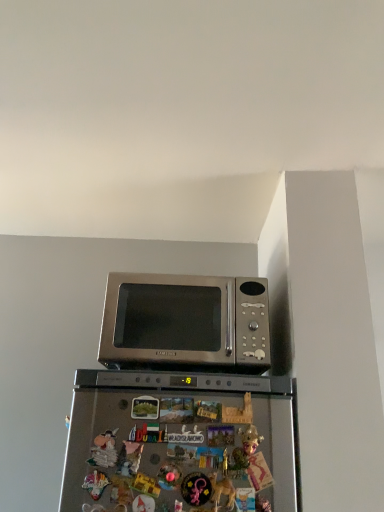
In the scene shown: What is the approximate width of stainless steel microwave at upper center?

It is 17.97 inches.

This screenshot has width=384, height=512. What do you see at coordinates (185, 323) in the screenshot?
I see `stainless steel microwave at upper center` at bounding box center [185, 323].

This screenshot has width=384, height=512. What are the coordinates of `stainless steel microwave at upper center` in the screenshot? It's located at (185, 323).

Measure the distance between point (185, 361) and camera.

The depth of point (185, 361) is 4.16 feet.

Identify the location of stainless steel microwave at upper center. The height and width of the screenshot is (512, 384). (185, 323).